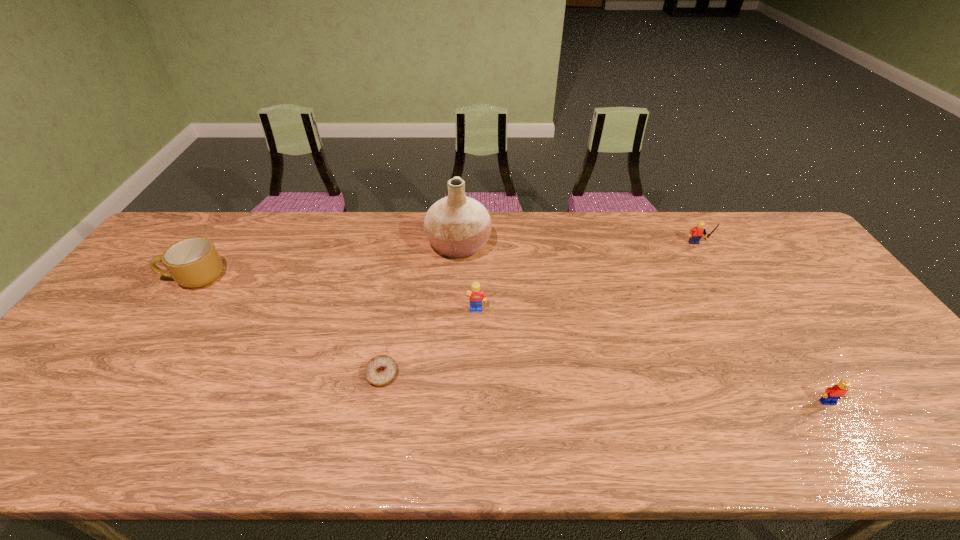
Identify the location of free spot between the fifth object from right to left and the fifth tallest object. This screenshot has height=540, width=960. (605, 388).

Image resolution: width=960 pixels, height=540 pixels. I want to click on free space between the rightmost object and the leftmost object, so click(512, 340).

Find the location of a particular element. This screenshot has height=540, width=960. free spot between the doughnut and the nearest Lego is located at coordinates (605, 388).

Image resolution: width=960 pixels, height=540 pixels. What are the coordinates of `vacant space that's between the pottery and the fourth farthest object` in the screenshot? It's located at (468, 279).

Locate an element on the screen. This screenshot has width=960, height=540. vacant space that is in between the leftmost Lego and the tallest Lego is located at coordinates (587, 279).

Identify which object is the fourth nearest to the third nearest object. Please provide its 2D coordinates. Your answer should be formatted as a tuple, i.e. [(x, y)], where the tuple contains the x and y coordinates of a point satisfying the conditions above.

[(194, 262)]

The width and height of the screenshot is (960, 540). I want to click on object that is the third closest to the leftmost Lego, so click(696, 233).

This screenshot has width=960, height=540. I want to click on Lego object that ranks as the closest to the doughnut, so click(475, 295).

The image size is (960, 540). Find the location of `Lego that stands as the second closest to the second shortest Lego`. Lego that stands as the second closest to the second shortest Lego is located at coordinates (831, 395).